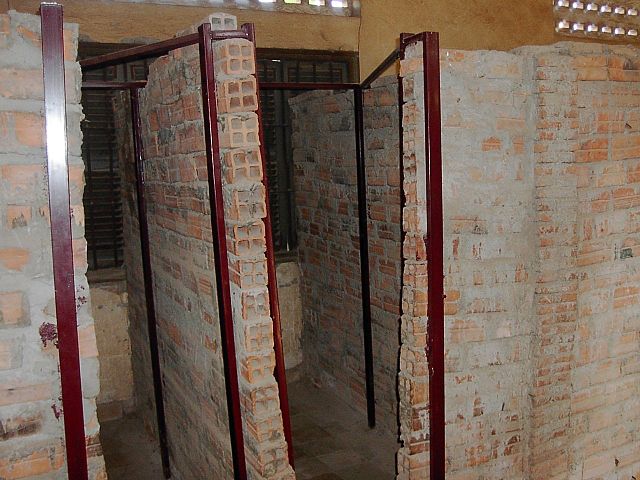
You are a GUI agent. You are given a task and a screenshot of the screen. Output one action in this format:
    pyautogui.click(x=<x>, y=<y>)
    Task: Click on the floor
    
    Given the screenshot: What is the action you would take?
    pyautogui.click(x=322, y=442), pyautogui.click(x=118, y=459)